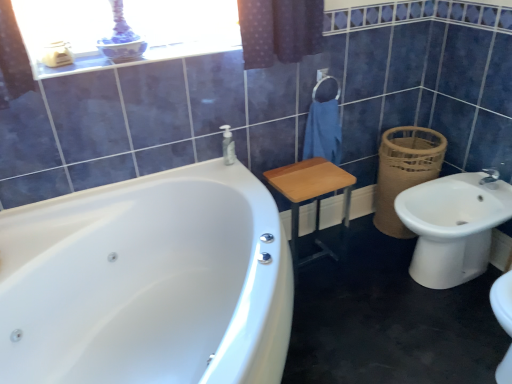
Where is `free area in between wooden stool at center and brown woven basket at right`? free area in between wooden stool at center and brown woven basket at right is located at coordinates (362, 242).